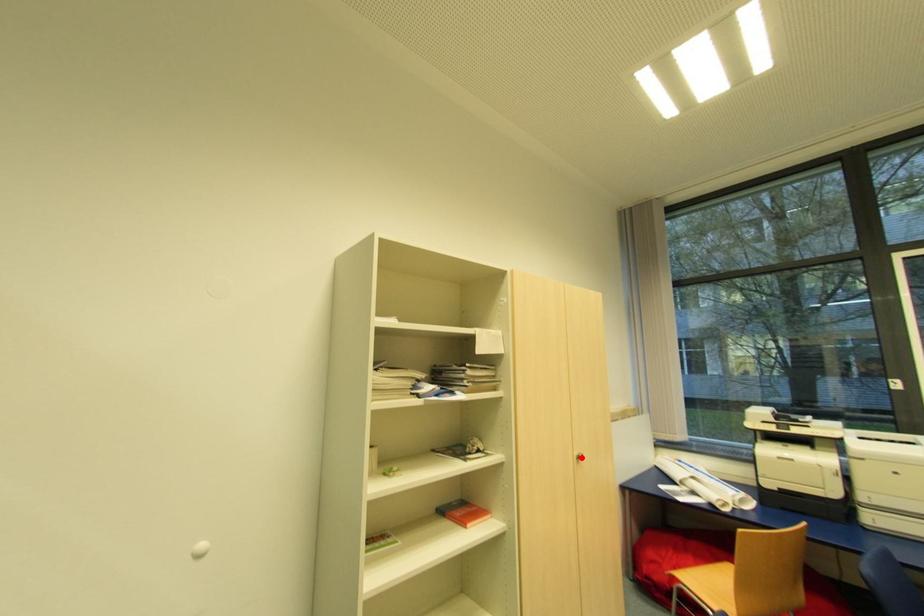
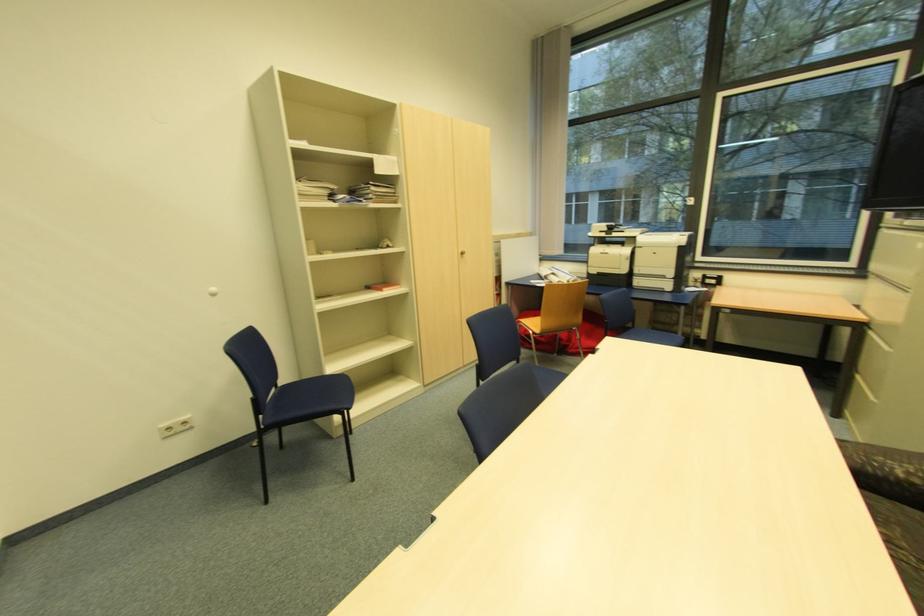
Find the pixel in the second image that matches the highlighted location in the first image.

(466, 254)